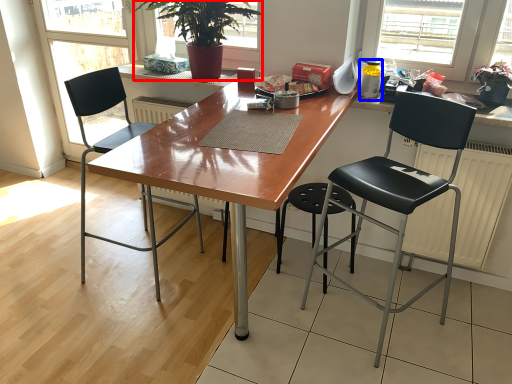
Question: Among these objects, which one is nearest to the camera, houseplant (highlighted by a red box) or bottle (highlighted by a blue box)?

Choices:
 (A) houseplant
 (B) bottle

Answer: (A)